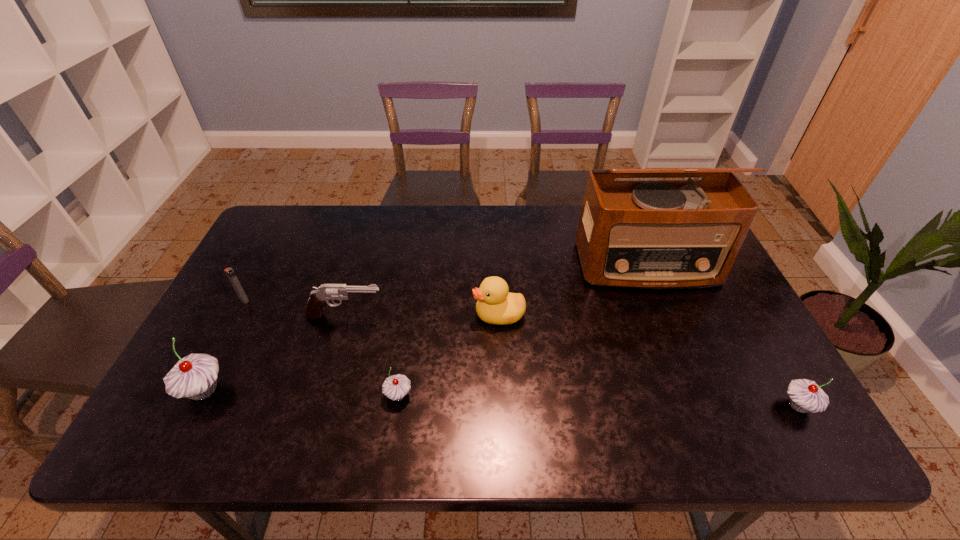
Find the location of a particular element. This screenshot has width=960, height=540. free location at the right edge is located at coordinates (707, 345).

Locate an element on the screen. This screenshot has width=960, height=540. free space at the far left corner of the desktop is located at coordinates (312, 209).

Identify the location of vacant area between the third object from right to left and the farthest object. (573, 290).

Find the location of `vacant space in between the second cupcake from left to right and the third object from left to right`. vacant space in between the second cupcake from left to right and the third object from left to right is located at coordinates (372, 356).

Find the location of `free spot between the farthest object and the rightmost cupcake`. free spot between the farthest object and the rightmost cupcake is located at coordinates (x=723, y=335).

Identify the location of free space between the leftmost cupcake and the second cupcake from left to right. This screenshot has height=540, width=960. (301, 393).

Where is `vacant space that's between the sixth shortest object and the igniter`? vacant space that's between the sixth shortest object and the igniter is located at coordinates (224, 345).

Identify the location of free space between the second shortest cupcake and the gun. point(572,361).

The image size is (960, 540). Find the location of `free space between the sixth shortest object and the tallest object`. free space between the sixth shortest object and the tallest object is located at coordinates (425, 328).

Image resolution: width=960 pixels, height=540 pixels. Find the location of `vacant region between the gun and the duck`. vacant region between the gun and the duck is located at coordinates (422, 315).